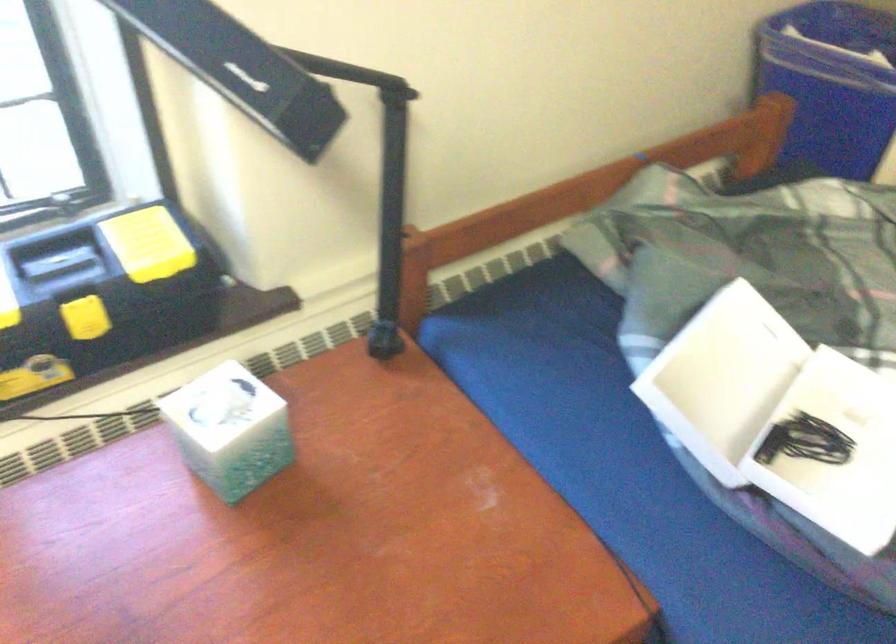
The image size is (896, 644). I want to click on yellow toolbox latch, so click(x=83, y=314).